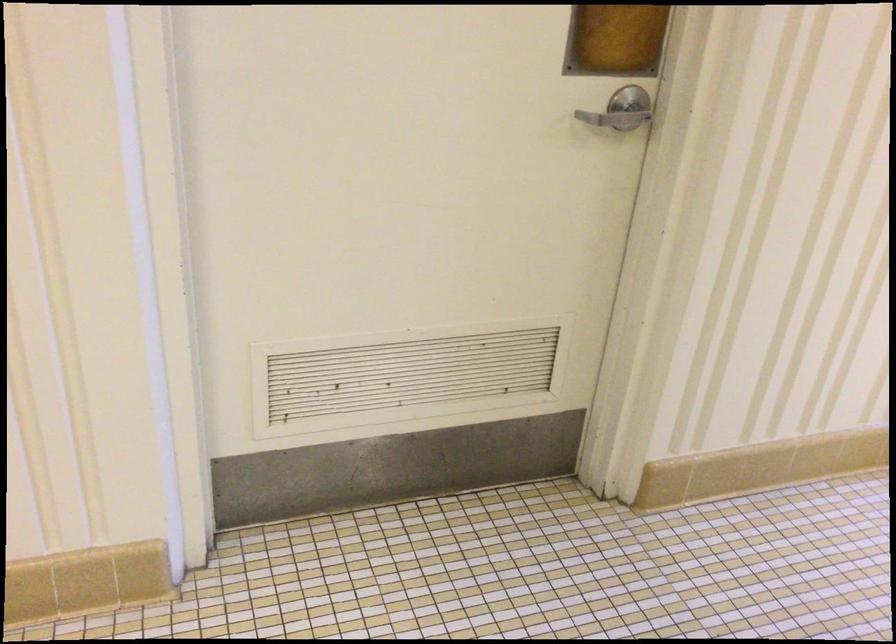
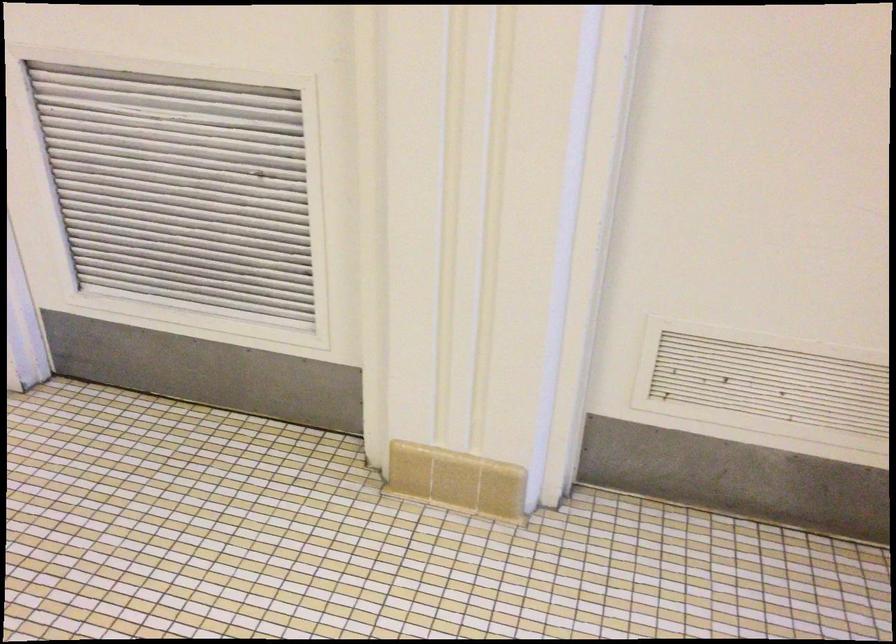
Question: The camera is either moving clockwise (left) or counter-clockwise (right) around the object. The first image is from the beginning of the video and the second image is from the end. Is the camera moving left or right when shooting the video?

Choices:
 (A) Left
 (B) Right

Answer: (B)